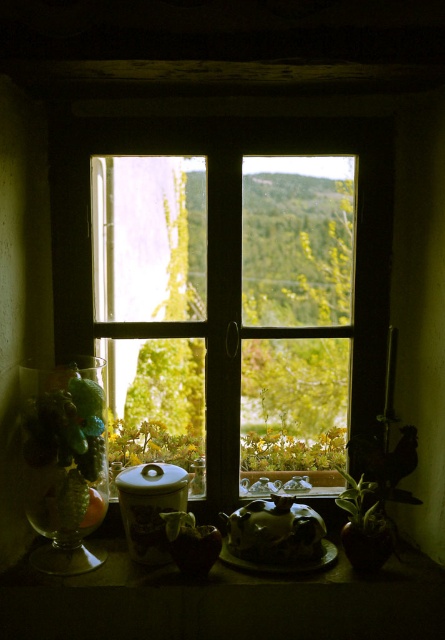
Is wooden window at center below matte ceramic teapot at center?

No, wooden window at center is not below matte ceramic teapot at center.

Who is more forward, (120, 202) or (311, 512)?

Point (311, 512) is more forward.

This screenshot has width=445, height=640. In order to click on wooden window at center in this screenshot , I will do pyautogui.click(x=229, y=273).